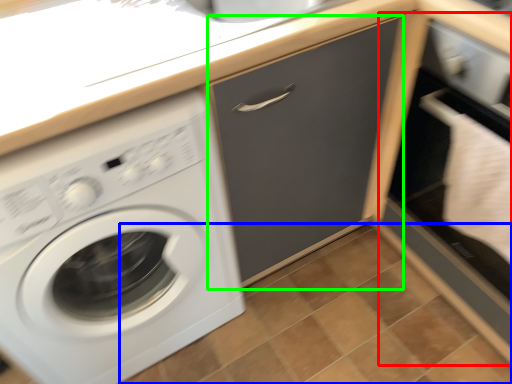
Question: Estimate the real-world distances between objects in this image. Which object is closer to file cabinet (highlighted by a red box), tile (highlighted by a blue box) or drawer (highlighted by a green box)?

Choices:
 (A) tile
 (B) drawer

Answer: (B)